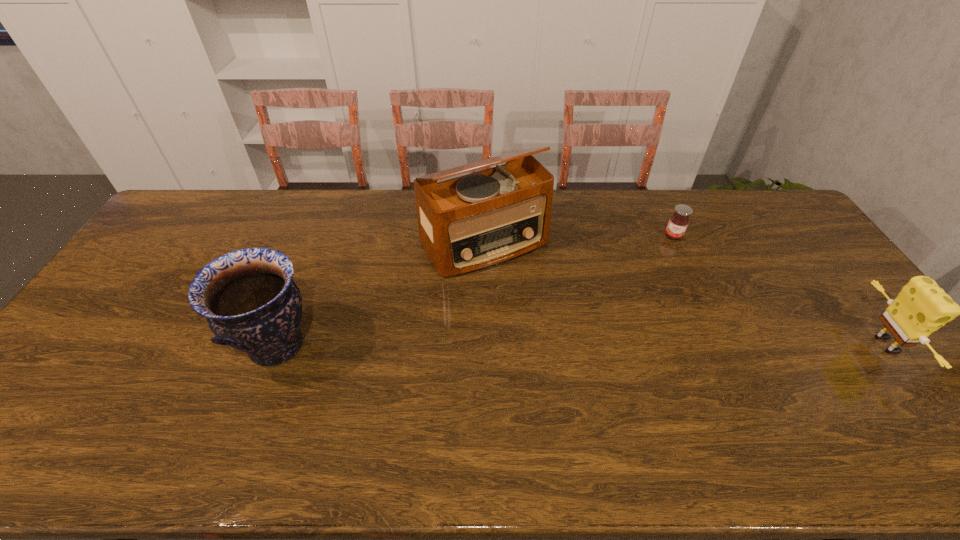
At what (x,y) coordinates should I click in order to perform the action: click on free region located 0.060m on the front handle of the third shortest object. Please return your answer as a coordinate pair (x, y). The height and width of the screenshot is (540, 960). Looking at the image, I should click on pos(213,346).

At what (x,y) coordinates should I click in order to perform the action: click on vacant point located on the front panel of the third object from right to left. Please return your answer as a coordinate pair (x, y). The height and width of the screenshot is (540, 960). Looking at the image, I should click on (538, 307).

You are a GUI agent. You are given a task and a screenshot of the screen. Output one action in this format:
    pyautogui.click(x=<x>, y=<y>)
    Task: Click on the vacant region located on the front panel of the third object from right to left
    This screenshot has height=540, width=960.
    Given the screenshot: What is the action you would take?
    pyautogui.click(x=575, y=357)

What are the coordinates of `free space located 0.350m on the front panel of the third object from right to left` in the screenshot? It's located at (580, 362).

The image size is (960, 540). I want to click on vacant space located 0.220m on the label side of the shortest object, so click(x=663, y=285).

The width and height of the screenshot is (960, 540). Identify the location of vacant position located on the label side of the shortest object. (661, 294).

Find the location of `blank space located 0.120m on the label side of the shortest object`. blank space located 0.120m on the label side of the shortest object is located at coordinates (667, 264).

Find the location of a particular element. radio receiver that is at the far edge is located at coordinates (468, 223).

Where is `jam that is at the far edge`? This screenshot has width=960, height=540. jam that is at the far edge is located at coordinates (679, 221).

At what (x,y) coordinates should I click in order to perform the action: click on pottery that is at the near edge. Please return your answer as a coordinate pair (x, y). Looking at the image, I should click on (251, 303).